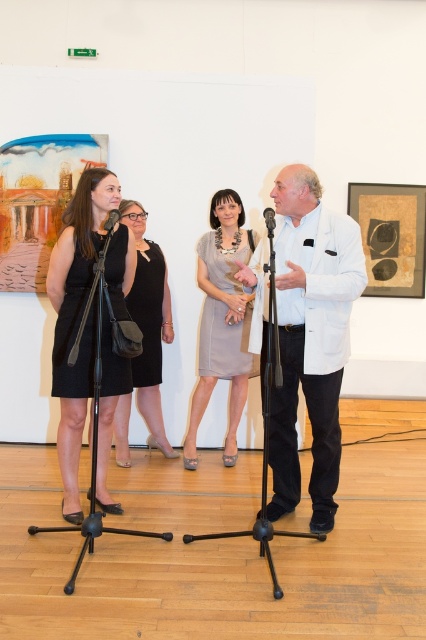
Is black matte microphone at left closer to the viewer compared to black matte microphone at center?

No.

Is black matte microphone at left bigger than black matte microphone at center?

Yes.

Which is in front, point (112, 216) or point (264, 220)?

Point (112, 216) is more forward.

The height and width of the screenshot is (640, 426). In order to click on black matte microphone at left in this screenshot , I will do `click(111, 220)`.

Between point (140, 243) and point (109, 224), which one is positioned behind?

Positioned behind is point (140, 243).

Which is below, black matte dress at center or black matte microphone at left?

black matte dress at center is lower down.

Is point (158, 346) behind point (115, 209)?

Yes.

Identify the location of black matte dress at center. (149, 323).

Is point (63, 528) farther from viewer compared to point (104, 228)?

No, it is in front of (104, 228).

Can you confirm if black metal tripod at left is thinner than black matte microphone at left?

In fact, black metal tripod at left might be wider than black matte microphone at left.

Which is behind, point (80, 554) or point (115, 209)?

Positioned behind is point (115, 209).

Identify the location of black metal tripod at left. Image resolution: width=426 pixels, height=640 pixels. (94, 474).